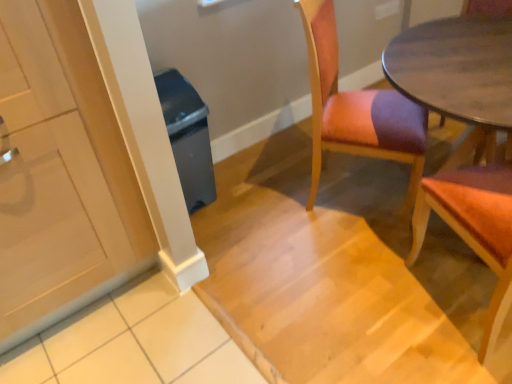
Question: Considering the relative sizes of wooden chair at right, arranged as the 2th chair when viewed from the left, and gray plastic trash can at left in the image provided, is wooden chair at right, arranged as the 2th chair when viewed from the left, taller than gray plastic trash can at left?

Choices:
 (A) no
 (B) yes

Answer: (B)

Question: Does wooden chair at right, arranged as the 2th chair when viewed from the left, lie behind gray plastic trash can at left?

Choices:
 (A) no
 (B) yes

Answer: (A)

Question: From a real-world perspective, is wooden chair at right, arranged as the 2th chair when viewed from the left, positioned under gray plastic trash can at left based on gravity?

Choices:
 (A) yes
 (B) no

Answer: (B)

Question: From the image's perspective, is wooden chair at right, arranged as the 2th chair when viewed from the left, located beneath gray plastic trash can at left?

Choices:
 (A) no
 (B) yes

Answer: (B)

Question: Considering the relative sizes of wooden chair at right, arranged as the 2th chair when viewed from the left, and gray plastic trash can at left in the image provided, is wooden chair at right, arranged as the 2th chair when viewed from the left, smaller than gray plastic trash can at left?

Choices:
 (A) yes
 (B) no

Answer: (B)

Question: Considering the positions of gray plastic trash can at left and wooden upholstered chair at center, acting as the 2th chair starting from the right, in the image, is gray plastic trash can at left taller or shorter than wooden upholstered chair at center, acting as the 2th chair starting from the right,?

Choices:
 (A) tall
 (B) short

Answer: (B)

Question: From a real-world perspective, is gray plastic trash can at left physically located above or below wooden upholstered chair at center, the first chair viewed from the left?

Choices:
 (A) above
 (B) below

Answer: (B)

Question: In terms of size, does gray plastic trash can at left appear bigger or smaller than wooden upholstered chair at center, acting as the 2th chair starting from the right?

Choices:
 (A) big
 (B) small

Answer: (B)

Question: Considering their positions, is gray plastic trash can at left located in front of or behind wooden upholstered chair at center, acting as the 2th chair starting from the right?

Choices:
 (A) behind
 (B) front

Answer: (A)

Question: Is wooden chair at right, marked as the first chair in a right-to-left arrangement, inside or outside of gray plastic trash can at left?

Choices:
 (A) outside
 (B) inside

Answer: (A)

Question: In the image, is wooden chair at right, marked as the first chair in a right-to-left arrangement, on the left side or the right side of gray plastic trash can at left?

Choices:
 (A) right
 (B) left

Answer: (A)

Question: Does point 462,203 appear closer or farther from the camera than point 165,117?

Choices:
 (A) farther
 (B) closer

Answer: (B)

Question: Looking at their shapes, would you say wooden chair at right, arranged as the 2th chair when viewed from the left, is wider or thinner than gray plastic trash can at left?

Choices:
 (A) thin
 (B) wide

Answer: (B)

Question: Is gray plastic trash can at left inside or outside of white glossy cabinet at left?

Choices:
 (A) inside
 (B) outside

Answer: (B)

Question: Is point (187, 84) closer or farther from the camera than point (24, 302)?

Choices:
 (A) closer
 (B) farther

Answer: (B)